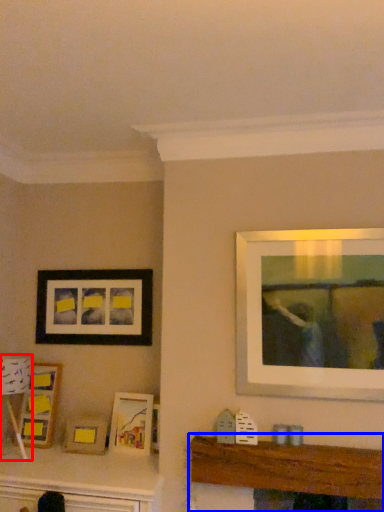
Question: Among these objects, which one is nearest to the camera, lamp (highlighted by a red box) or table (highlighted by a blue box)?

Choices:
 (A) lamp
 (B) table

Answer: (B)